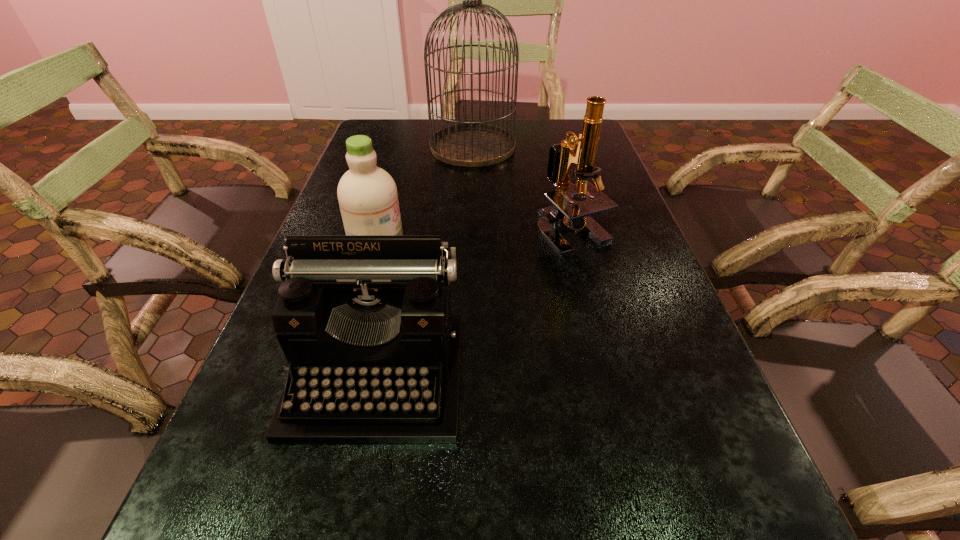
At what (x,y) coordinates should I click in order to perform the action: click on object located at the far edge. Please return your answer as a coordinate pair (x, y). The image size is (960, 540). Looking at the image, I should click on 471,144.

The height and width of the screenshot is (540, 960). I want to click on cleansing agent that is at the left edge, so click(x=368, y=199).

Identify the location of typewriter present at the left edge. (365, 322).

This screenshot has height=540, width=960. Identify the location of object that is at the right edge. (565, 211).

The image size is (960, 540). In order to click on free spot at the far edge of the desktop in this screenshot , I will do click(521, 140).

In the image, there is a desktop. What are the coordinates of `vacant region at the right edge` in the screenshot? It's located at coord(663,474).

At what (x,y) coordinates should I click in order to perform the action: click on free point at the far left corner. Please return your answer as a coordinate pair (x, y). This screenshot has width=960, height=540. Looking at the image, I should click on (387, 145).

The height and width of the screenshot is (540, 960). What are the coordinates of `free spot between the rightmost object and the farthest object` in the screenshot? It's located at (522, 190).

Where is `free space between the cleansing agent and the rightmost object`? The height and width of the screenshot is (540, 960). free space between the cleansing agent and the rightmost object is located at coordinates (474, 235).

At what (x,y) coordinates should I click in order to perform the action: click on free area in between the rightmost object and the typewriter. Please return your answer as a coordinate pair (x, y). This screenshot has width=960, height=540. Looking at the image, I should click on (474, 303).